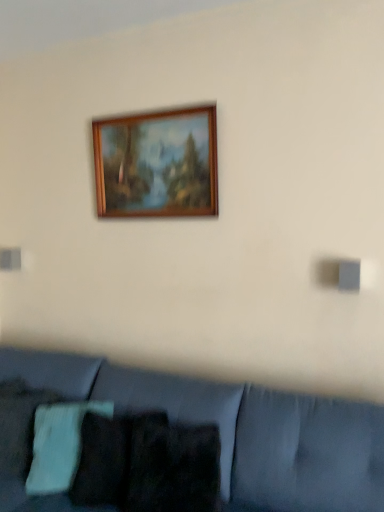
Question: Can you confirm if green knitted pillow at lower left is smaller than velvet blue couch at lower center?

Choices:
 (A) no
 (B) yes

Answer: (B)

Question: From a real-world perspective, is green knitted pillow at lower left on top of velvet blue couch at lower center?

Choices:
 (A) no
 (B) yes

Answer: (B)

Question: Can we say green knitted pillow at lower left lies outside velvet blue couch at lower center?

Choices:
 (A) yes
 (B) no

Answer: (B)

Question: Is green knitted pillow at lower left positioned far away from velvet blue couch at lower center?

Choices:
 (A) yes
 (B) no

Answer: (B)

Question: Is green knitted pillow at lower left at the left side of velvet blue couch at lower center?

Choices:
 (A) no
 (B) yes

Answer: (B)

Question: Is green knitted pillow at lower left taller or shorter than velvet blue couch at lower center?

Choices:
 (A) tall
 (B) short

Answer: (B)

Question: Considering the positions of green knitted pillow at lower left and velvet blue couch at lower center in the image, is green knitted pillow at lower left wider or thinner than velvet blue couch at lower center?

Choices:
 (A) thin
 (B) wide

Answer: (A)

Question: Considering the positions of green knitted pillow at lower left and velvet blue couch at lower center in the image, is green knitted pillow at lower left bigger or smaller than velvet blue couch at lower center?

Choices:
 (A) big
 (B) small

Answer: (B)

Question: Considering their positions, is green knitted pillow at lower left located in front of or behind velvet blue couch at lower center?

Choices:
 (A) behind
 (B) front

Answer: (A)

Question: Choose the correct answer: Is wooden frame at upper center inside green knitted pillow at lower left or outside it?

Choices:
 (A) inside
 (B) outside

Answer: (B)

Question: Is wooden frame at upper center bigger or smaller than green knitted pillow at lower left?

Choices:
 (A) big
 (B) small

Answer: (B)

Question: Considering the positions of wooden frame at upper center and green knitted pillow at lower left in the image, is wooden frame at upper center wider or thinner than green knitted pillow at lower left?

Choices:
 (A) thin
 (B) wide

Answer: (A)

Question: Based on their positions, is wooden frame at upper center located to the left or right of green knitted pillow at lower left?

Choices:
 (A) right
 (B) left

Answer: (A)

Question: Is velvet blue couch at lower center bigger or smaller than green knitted pillow at lower left?

Choices:
 (A) small
 (B) big

Answer: (B)

Question: Is point (220, 423) closer or farther from the camera than point (62, 435)?

Choices:
 (A) farther
 (B) closer

Answer: (B)